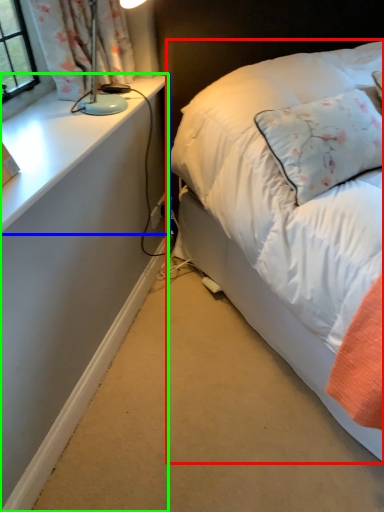
Question: Estimate the real-world distances between objects in this image. Which object is farther from bed (highlighted by a red box), table (highlighted by a blue box) or desk (highlighted by a green box)?

Choices:
 (A) table
 (B) desk

Answer: (A)